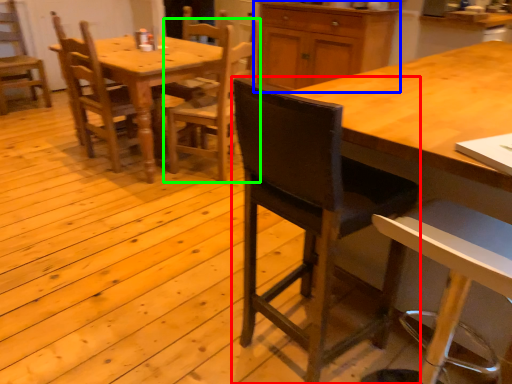
Question: Which is nearer to the chair (highlighted by a red box)? cabinetry (highlighted by a blue box) or chair (highlighted by a green box).

Choices:
 (A) cabinetry
 (B) chair

Answer: (B)